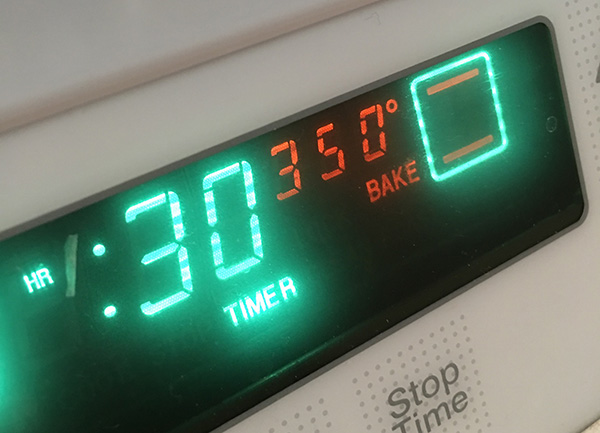
Image resolution: width=600 pixels, height=433 pixels. In order to click on clock screen in this screenshot , I will do `click(415, 285)`.